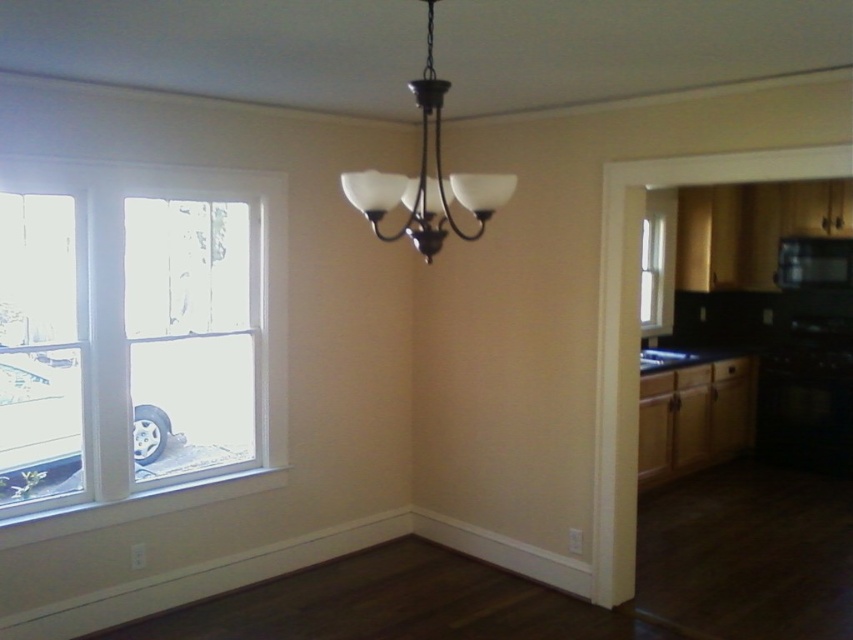
Between white glass window at left and black matte microwave at upper right, which one has more height?

white glass window at left

Find the location of `white glass window at left`. white glass window at left is located at coordinates (138, 330).

I want to click on white glass window at left, so click(138, 330).

How distant is matte black chandelier at upper center from clear glass window at right?

They are 7.77 feet apart.

Looking at this image, between matte black chandelier at upper center and clear glass window at right, which one has more height?

clear glass window at right

Which is behind, point (457, 188) or point (645, 234)?

The point (645, 234) is more distant.

Where is `matte black chandelier at upper center`? The height and width of the screenshot is (640, 853). matte black chandelier at upper center is located at coordinates (427, 177).

Can you confirm if matte black chandelier at upper center is positioned to the right of black matte microwave at upper right?

Incorrect, matte black chandelier at upper center is not on the right side of black matte microwave at upper right.

Can you confirm if matte black chandelier at upper center is bigger than black matte microwave at upper right?

Yes.

Does point (399, 192) come in front of point (843, 284)?

Yes, point (399, 192) is closer to viewer.

Locate an element on the screen. The width and height of the screenshot is (853, 640). matte black chandelier at upper center is located at coordinates (427, 177).